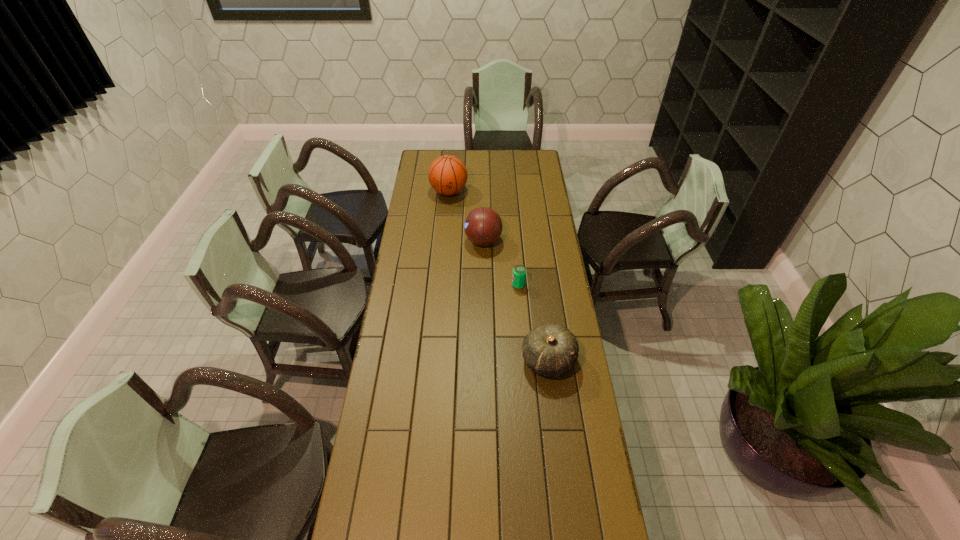
Locate an element on the screen. The height and width of the screenshot is (540, 960). the farther basketball is located at coordinates (447, 175).

Locate an element on the screen. the second farthest object is located at coordinates (483, 226).

At what (x,y) coordinates should I click in order to perform the action: click on the shorter basketball. Please return your answer as a coordinate pair (x, y). The width and height of the screenshot is (960, 540). Looking at the image, I should click on (483, 226).

Identify the location of the third tallest object. This screenshot has width=960, height=540. (551, 350).

Find the location of a particular element. The width and height of the screenshot is (960, 540). gourd is located at coordinates (551, 350).

Identify the location of the shortest object. (519, 272).

Find the location of `the third farthest object`. the third farthest object is located at coordinates (519, 272).

Where is `vacant area located 0.200m on the back of the farthest object`? The width and height of the screenshot is (960, 540). vacant area located 0.200m on the back of the farthest object is located at coordinates (451, 163).

Identify the location of free space located on the back of the shorter basketball. This screenshot has width=960, height=540. (483, 200).

Where is `blank space located 0.370m on the front of the gourd`? blank space located 0.370m on the front of the gourd is located at coordinates (564, 490).